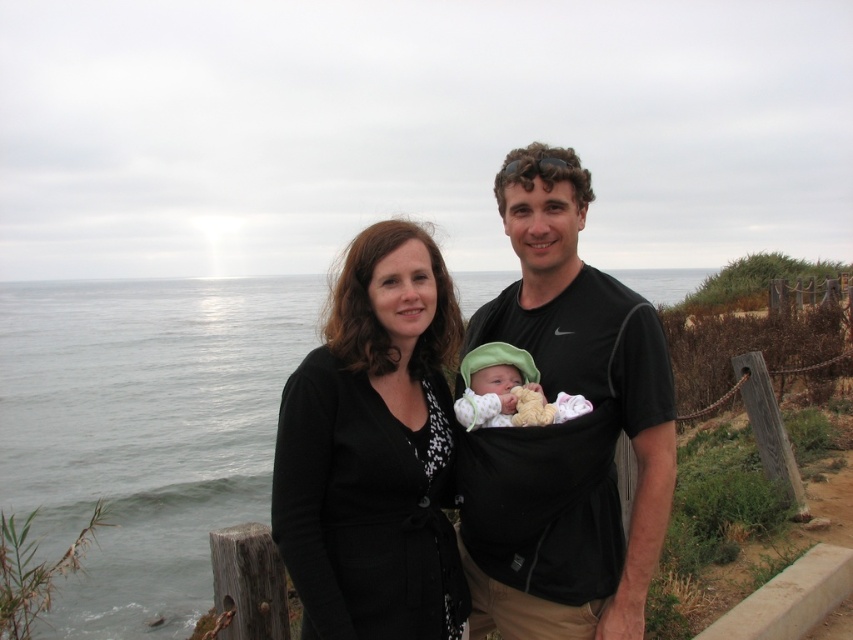
You are a photographer trying to position two markers for a family photo shoot. The first marker is at point [606,588], and the second is at point [515,378]. Based on the scene, which marker is closer to the camera?

Point [606,588] is in front of point [515,378], so the first marker is closer to the camera.

You are a photographer setting up for a family photo shoot. You need to ensure that the black fabric baby carrier at center and the soft green knit hat at center are both visible in the frame. Given their sizes, which object might require you to adjust your camera angle to include it fully?

The black fabric baby carrier at center is wider than the soft green knit hat at center, so you might need to adjust your camera angle to ensure the black fabric baby carrier at center fits entirely within the frame.